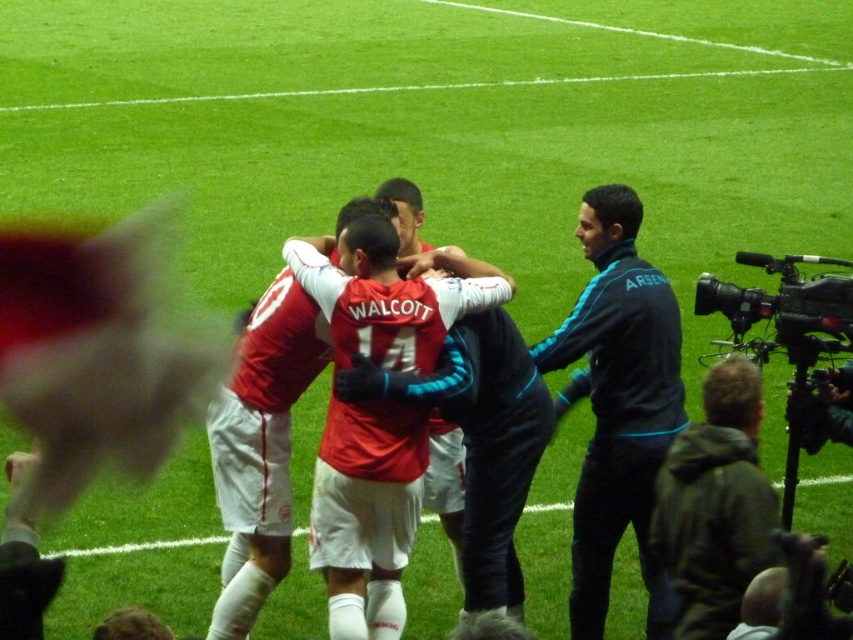
Looking at this image, you are a photographer standing in the middle of the soccer field. You want to take a photo of the blue synthetic jacket at right and the dark gray hoodie at lower right. Which one will appear larger in your photo?

The blue synthetic jacket at right is closer to the viewer than the dark gray hoodie at lower right, so it will appear larger in the photo.

You are a photographer trying to capture the soccer players in the foreground. You have a dark gray hoodie at lower right and a black plastic video camera at right. Which object is closer to the front of the scene?

The dark gray hoodie at lower right is positioned on the left side of black plastic video camera at right, so the dark gray hoodie at lower right is closer to the front.

You are a photographer standing at the edge of the soccer field. You need to capture a photo of the blue synthetic jacket at right and dark gray hoodie at lower right. Which one is positioned more to the right side of the image?

The blue synthetic jacket at right is positioned more to the right side of the image compared to the dark gray hoodie at lower right.